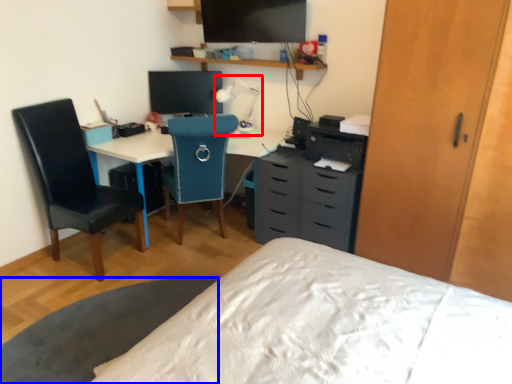
Question: Which object appears closest to the camera in this image, table lamp (highlighted by a red box) or table (highlighted by a blue box)?

Choices:
 (A) table lamp
 (B) table

Answer: (B)